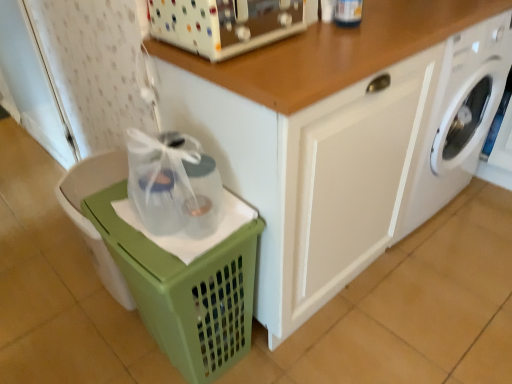
Locate an element on the screen. The width and height of the screenshot is (512, 384). vacant area that is in front of white plastic toaster at upper center is located at coordinates (268, 67).